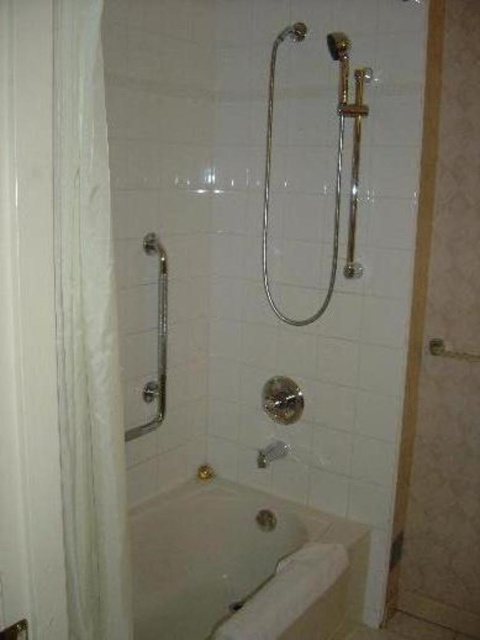
Which is below, white glossy bathtub at lower center or silver metallic grab bar at upper left?

white glossy bathtub at lower center is lower down.

Looking at this image, who is shorter, white glossy bathtub at lower center or silver metallic grab bar at upper left?

With less height is white glossy bathtub at lower center.

Where is `white glossy bathtub at lower center`? white glossy bathtub at lower center is located at coordinates (241, 566).

Can you confirm if silver metallic shower head at upper center is positioned to the left of silver metallic grab bar at upper left?

In fact, silver metallic shower head at upper center is to the right of silver metallic grab bar at upper left.

I want to click on silver metallic shower head at upper center, so click(x=269, y=173).

How far apart are white wood screen door at left and satin nickel showerhead at upper center?

1.52 meters

Is white wood screen door at left below satin nickel showerhead at upper center?

Indeed, white wood screen door at left is positioned under satin nickel showerhead at upper center.

Who is more forward, (1, 189) or (337, 54)?

Point (1, 189) is more forward.

The width and height of the screenshot is (480, 640). I want to click on white wood screen door at left, so click(x=28, y=328).